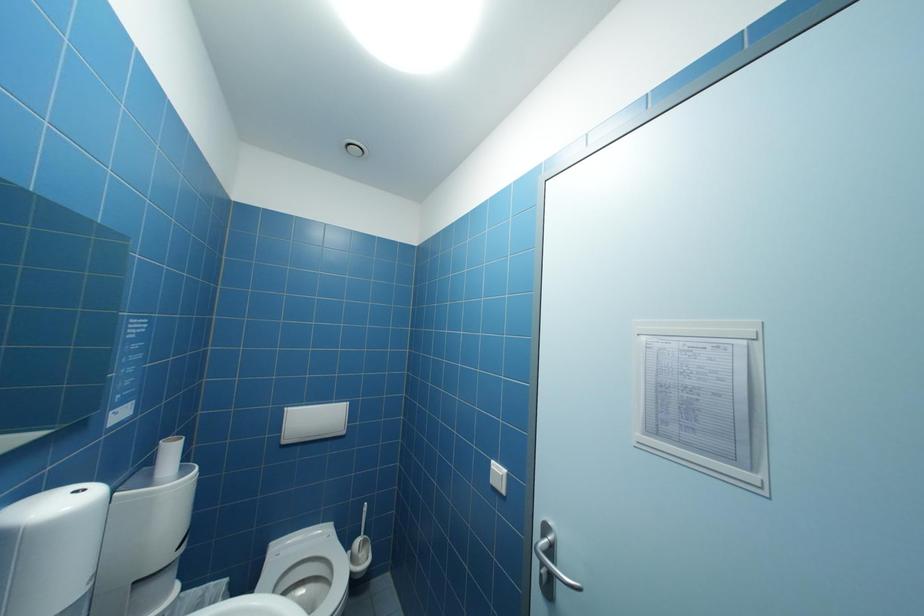
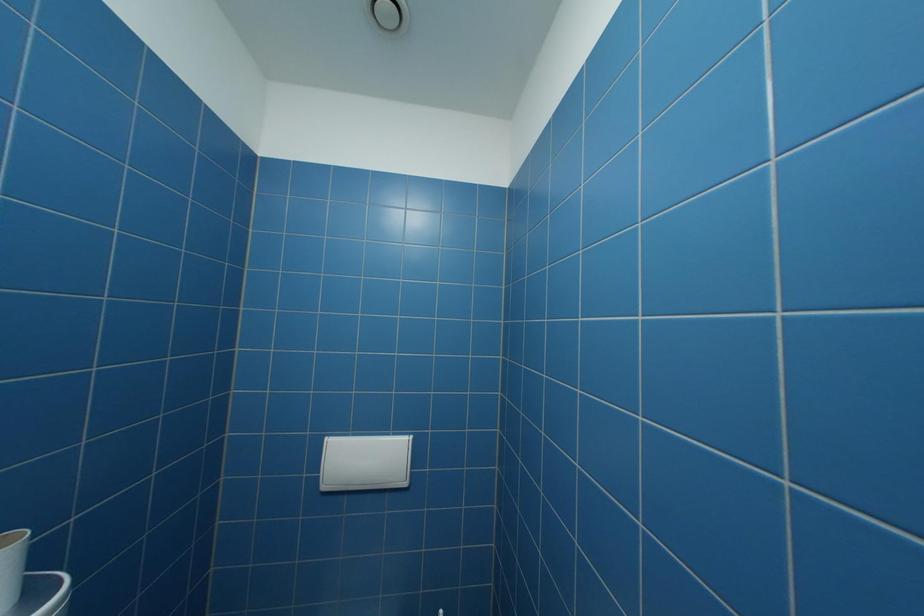
Question: In a continuous first-person perspective shot, in which direction is the camera moving?

Choices:
 (A) Left
 (B) Right
 (C) Forward
 (D) Backward

Answer: (C)